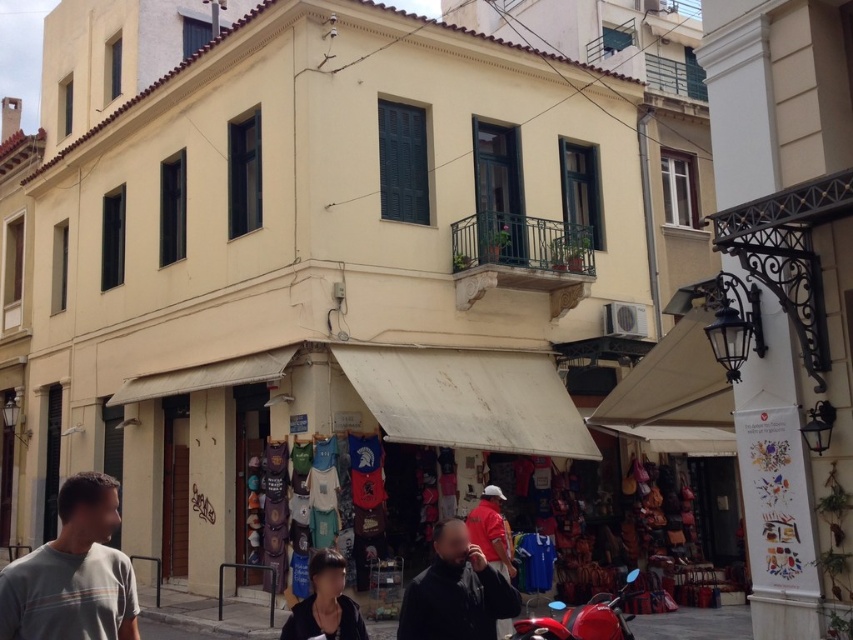
You are a customer looking to buy a dark blue fabric at center to cover your shiny red motorcycle at lower right. Based on the scene, will the fabric be large enough to cover the motorcycle?

The dark blue fabric at center has a smaller size compared to shiny red motorcycle at lower right, so it will not be large enough to cover the motorcycle.

You are a customer looking to buy a dark blue fabric at center and need to park your shiny red motorcycle at lower right. Where should you place the motorcycle relative to the fabric?

The dark blue fabric at center is to the left of the shiny red motorcycle at lower right, so you should park the shiny red motorcycle at lower right to the right of the dark blue fabric at center.

You are standing on the street corner and see the gray striped shirt at lower left displayed in a shop. If you want to reach out and touch it, will you be able to do so without moving closer?

The gray striped shirt at lower left is 17.07 feet away from the viewer, so you cannot reach it without moving closer since the distance is too far.